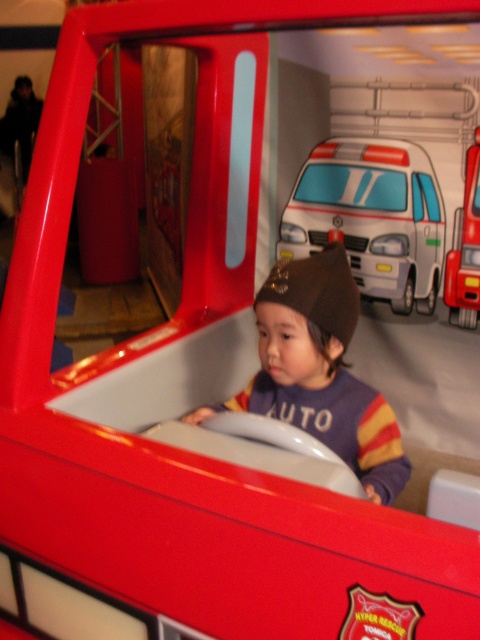
Question: Among these objects, which one is nearest to the camera?

Choices:
 (A) purple soft hat at center
 (B) white glossy ambulance at upper center
 (C) metallic red fire truck at center

Answer: (A)

Question: Considering the relative positions of purple soft hat at center and white glossy ambulance at upper center in the image provided, where is purple soft hat at center located with respect to white glossy ambulance at upper center?

Choices:
 (A) above
 (B) below

Answer: (B)

Question: Which object is positioned farthest from the purple soft hat at center?

Choices:
 (A) white glossy ambulance at upper center
 (B) metallic red fire truck at center

Answer: (B)

Question: Which point is closer to the camera?

Choices:
 (A) 372,234
 (B) 311,344

Answer: (B)

Question: Is purple soft hat at center wider than white glossy ambulance at upper center?

Choices:
 (A) yes
 (B) no

Answer: (B)

Question: Can you confirm if purple soft hat at center is positioned below white glossy ambulance at upper center?

Choices:
 (A) yes
 (B) no

Answer: (A)